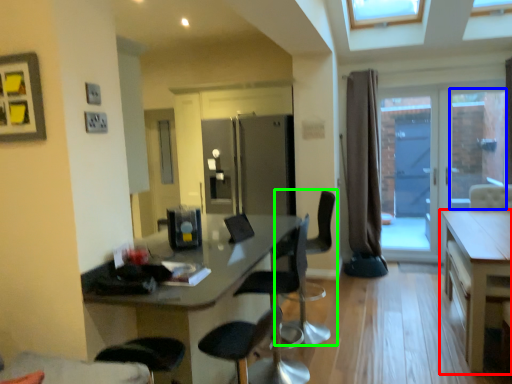
Question: Which object is the closest to the table (highlighted by a red box)? Choose among these: window (highlighted by a blue box) or chair (highlighted by a green box).

Choices:
 (A) window
 (B) chair

Answer: (B)